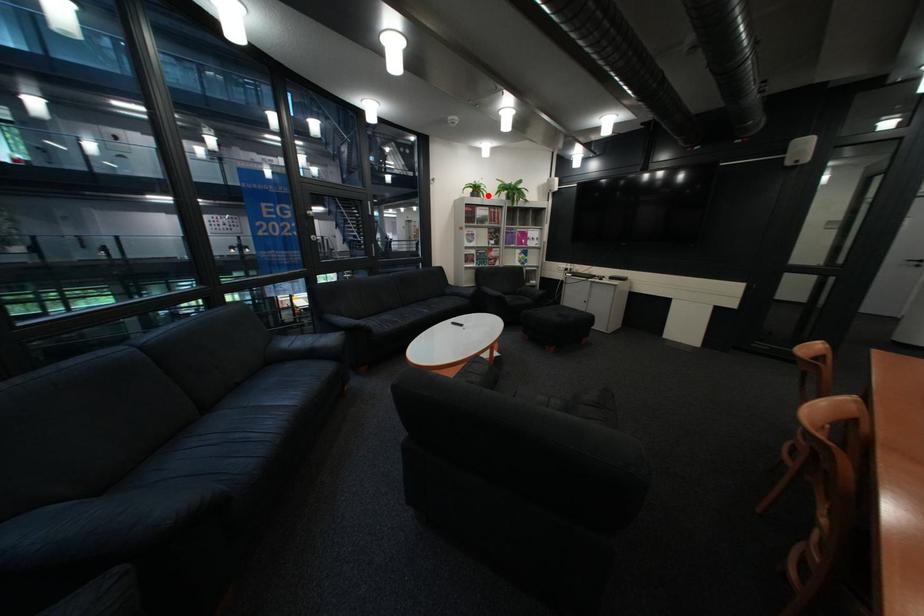
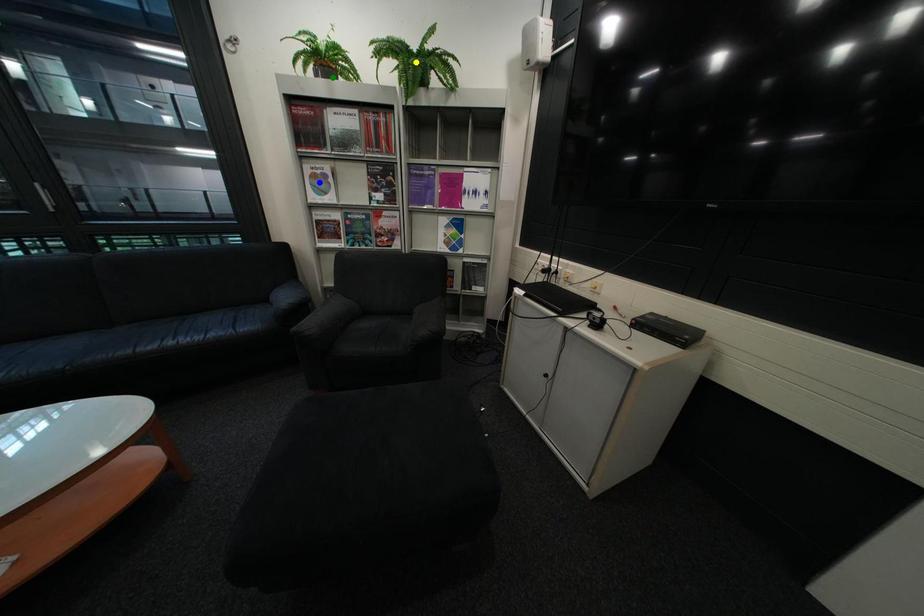
Question: I am providing you with two images of the same scene from different viewpoints. A red point is marked on the first image. You are given multiple points on the second image. Which point in image 2 is actually the same real-world point as the red point in image 1?

Choices:
 (A) blue point
 (B) green point
 (C) yellow point

Answer: (B)